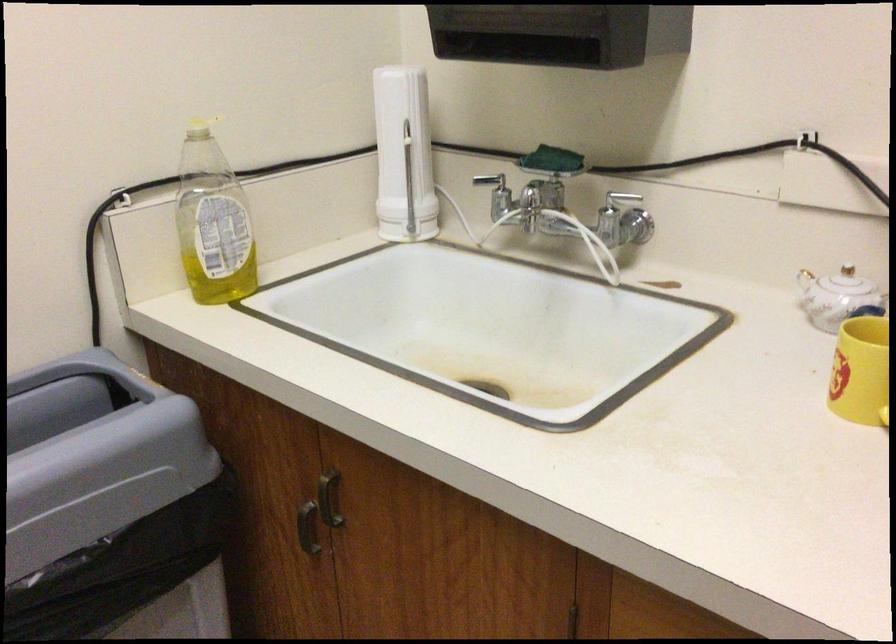
This screenshot has height=644, width=896. What are the coordinates of `water filter lever` in the screenshot? It's located at (496, 194).